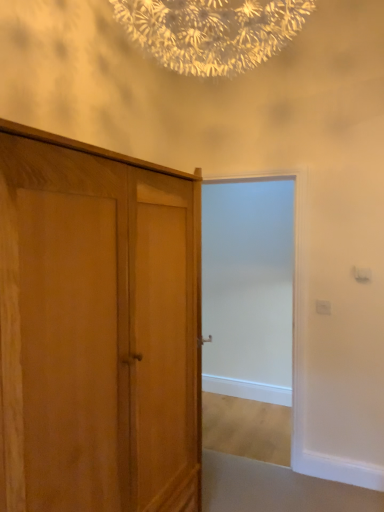
Question: Should I look upward or downward to see wooden wardrobe at left?

Choices:
 (A) up
 (B) down

Answer: (B)

Question: Considering the relative positions of white frosted glass door at center and wooden wardrobe at left in the image provided, is white frosted glass door at center to the right of wooden wardrobe at left from the viewer's perspective?

Choices:
 (A) no
 (B) yes

Answer: (B)

Question: Can you confirm if white frosted glass door at center is shorter than wooden wardrobe at left?

Choices:
 (A) no
 (B) yes

Answer: (A)

Question: From a real-world perspective, is white frosted glass door at center positioned over wooden wardrobe at left based on gravity?

Choices:
 (A) yes
 (B) no

Answer: (A)

Question: From the image's perspective, is white frosted glass door at center on wooden wardrobe at left?

Choices:
 (A) yes
 (B) no

Answer: (A)

Question: Is white frosted glass door at center turned away from wooden wardrobe at left?

Choices:
 (A) yes
 (B) no

Answer: (B)

Question: From the image's perspective, is white frosted glass door at center under wooden wardrobe at left?

Choices:
 (A) yes
 (B) no

Answer: (B)

Question: Can you confirm if wooden wardrobe at left is wider than white frosted glass door at center?

Choices:
 (A) yes
 (B) no

Answer: (A)

Question: Is wooden wardrobe at left oriented away from white frosted glass door at center?

Choices:
 (A) no
 (B) yes

Answer: (A)

Question: Is wooden wardrobe at left not within white frosted glass door at center?

Choices:
 (A) yes
 (B) no

Answer: (A)

Question: Does wooden wardrobe at left turn towards white frosted glass door at center?

Choices:
 (A) yes
 (B) no

Answer: (B)

Question: From the image's perspective, is wooden wardrobe at left under white frosted glass door at center?

Choices:
 (A) no
 (B) yes

Answer: (B)

Question: From the image's perspective, is wooden wardrobe at left on top of white frosted glass door at center?

Choices:
 (A) no
 (B) yes

Answer: (A)

Question: Looking at the image, does white frosted glass door at center seem bigger or smaller compared to wooden wardrobe at left?

Choices:
 (A) small
 (B) big

Answer: (A)